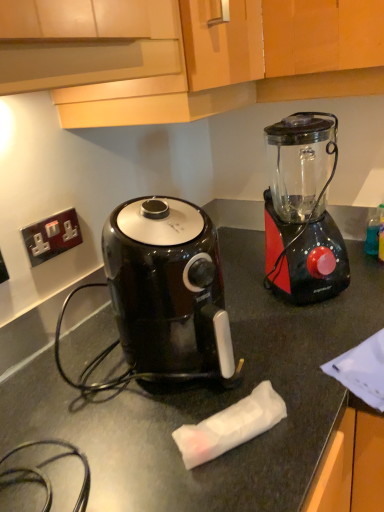
Question: Visually, is metallic socket at upper left positioned to the left or to the right of wooden cabinet at upper center?

Choices:
 (A) left
 (B) right

Answer: (A)

Question: From the image's perspective, relative to wooden cabinet at upper center, is metallic socket at upper left above or below?

Choices:
 (A) below
 (B) above

Answer: (A)

Question: Which is nearer to the black glossy air fryer at center?

Choices:
 (A) black plastic blender at right
 (B) metallic socket at upper left
 (C) wooden cabinet at upper center

Answer: (C)

Question: Which object is the closest to the wooden cabinet at upper center?

Choices:
 (A) black glossy air fryer at center
 (B) metallic socket at upper left
 (C) black plastic blender at right

Answer: (C)